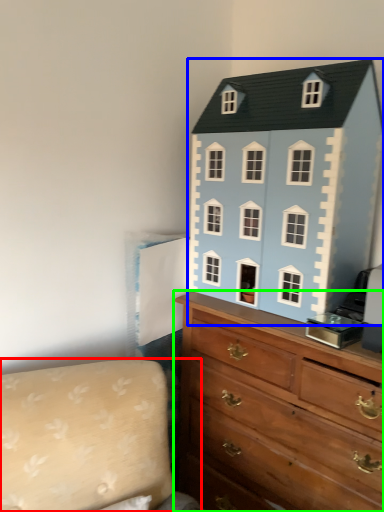
Question: Considering the real-world distances, which object is farthest from couch (highlighted by a red box)? toy (highlighted by a blue box) or chest of drawers (highlighted by a green box)?

Choices:
 (A) toy
 (B) chest of drawers

Answer: (A)